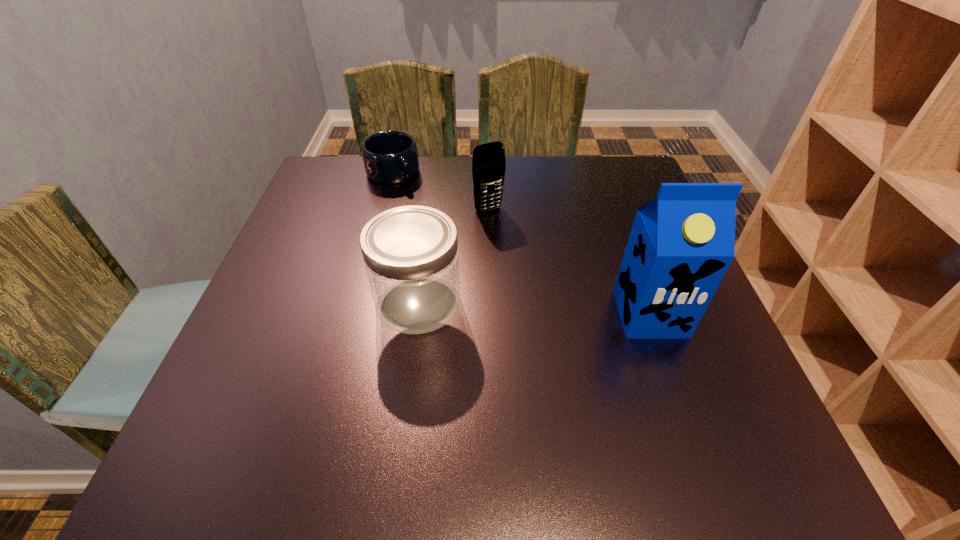
Locate an element on the screen. free space at the far edge is located at coordinates (536, 189).

Image resolution: width=960 pixels, height=540 pixels. Identify the location of free space at the near edge of the desktop. (481, 376).

In the image, there is a desktop. Identify the location of free space at the left edge. (326, 238).

Locate an element on the screen. This screenshot has width=960, height=540. free spot at the far right corner of the desktop is located at coordinates (619, 193).

Locate an element on the screen. vacant area at the near right corner of the desktop is located at coordinates (729, 408).

Image resolution: width=960 pixels, height=540 pixels. I want to click on empty space that is in between the mug and the second object from right to left, so tap(441, 191).

Find the location of a particular element. vacant region between the jar and the tallest object is located at coordinates (534, 308).

Locate an element on the screen. The height and width of the screenshot is (540, 960). free space between the farthest object and the third nearest object is located at coordinates (441, 191).

Where is `free space between the second object from right to left and the mug`? The image size is (960, 540). free space between the second object from right to left and the mug is located at coordinates (441, 191).

Identify the location of free spot between the rightmost object and the mug. The width and height of the screenshot is (960, 540). (521, 244).